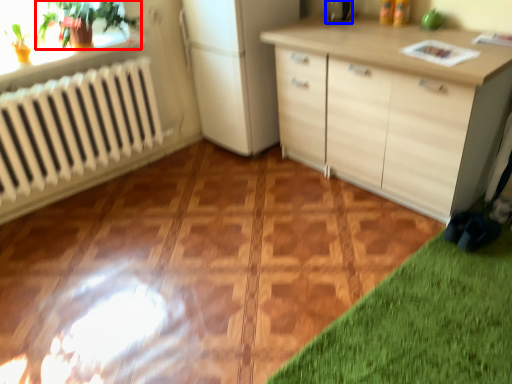
Question: Which object appears farthest to the camera in this image, plant (highlighted by a red box) or appliance (highlighted by a blue box)?

Choices:
 (A) plant
 (B) appliance

Answer: (B)